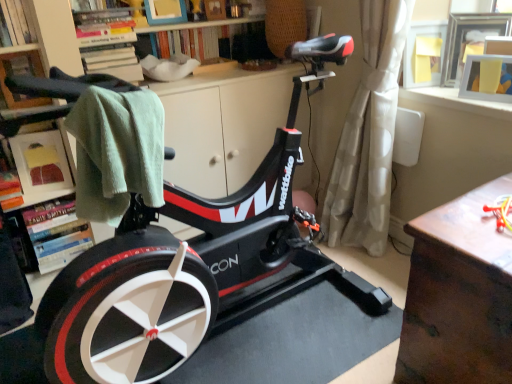
Question: In the image, is wooden picture frame at upper right, placed as the second picture frame when sorted from back to front, positioned in front of or behind matte white frame at upper left, which is the second shelf from back to front?

Choices:
 (A) front
 (B) behind

Answer: (A)

Question: In terms of size, does wooden picture frame at upper right, the first picture frame viewed from the front, appear bigger or smaller than matte white frame at upper left, which is the second shelf from back to front?

Choices:
 (A) big
 (B) small

Answer: (B)

Question: Estimate the real-world distances between objects in this image. Which object is farther from the wooden bookshelf at upper center, the first shelf in the back-to-front sequence?

Choices:
 (A) beige sheer curtain at right
 (B) black matte stationary bicycle at center
 (C) matte white frame at upper left, which is the second shelf from back to front
 (D) brown wooden table at right
 (E) matte black towel at left, the first shelf from the front

Answer: (D)

Question: Estimate the real-world distances between objects in this image. Which object is closer to the wooden picture frame at upper right, placed as the second picture frame when sorted from back to front?

Choices:
 (A) black matte stationary bicycle at center
 (B) beige sheer curtain at right
 (C) wooden picture frame at upper right, placed as the 2th picture frame when sorted from front to back
 (D) matte black towel at left, the first shelf from the front
 (E) wooden bookshelf at upper center, the first shelf in the back-to-front sequence

Answer: (C)